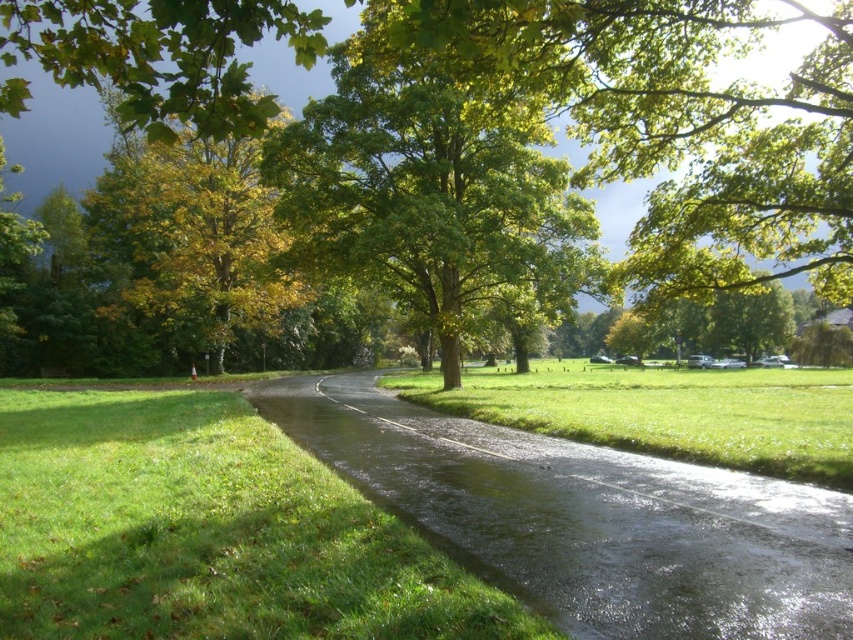
Does point (657, 474) come farther from viewer compared to point (842, 448)?

No, (657, 474) is closer to viewer.

Which of these two, glossy asphalt path at center or green grassy at center, stands taller?

Standing taller between the two is green grassy at center.

Is point (572, 529) farther from camera compared to point (595, 369)?

No, it is not.

Where is `glossy asphalt path at center`? glossy asphalt path at center is located at coordinates (589, 518).

Who is more distant from viewer, [361,109] or [665,428]?

The point [361,109] is behind.

Who is more forward, [285,180] or [547,429]?

Point [547,429] is in front.

Identify the location of green leafy tree at center. (432, 195).

Can you confirm if glossy asphalt path at center is smaller than yellow-green leaves at upper left?

Indeed, glossy asphalt path at center has a smaller size compared to yellow-green leaves at upper left.

Measure the distance between glossy asphalt path at center and camera.

4.21 meters

In order to click on glossy asphalt path at center in this screenshot , I will do `click(589, 518)`.